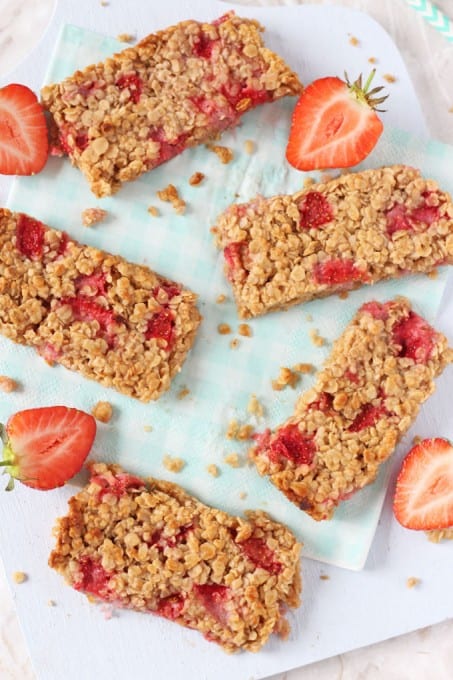
This screenshot has height=680, width=453. What are the coordinates of `corner of a dish towel` in the screenshot? It's located at (361, 571), (65, 24).